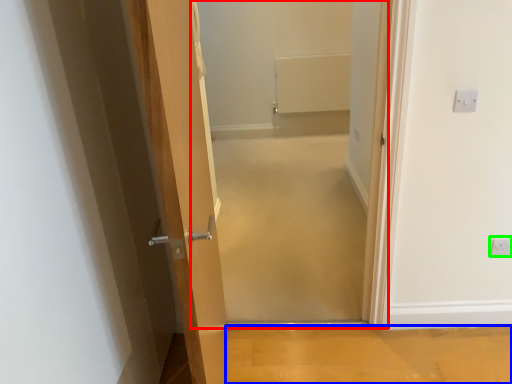
Question: Based on their relative distances, which object is nearer to corridor (highlighted by a red box)? Choose from plain (highlighted by a blue box) and electric outlet (highlighted by a green box).

Choices:
 (A) plain
 (B) electric outlet

Answer: (A)